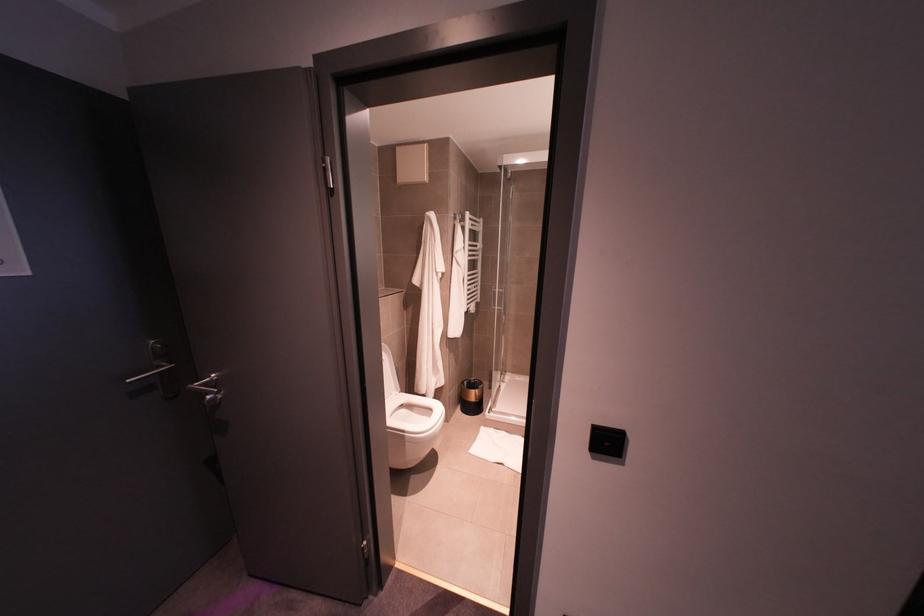
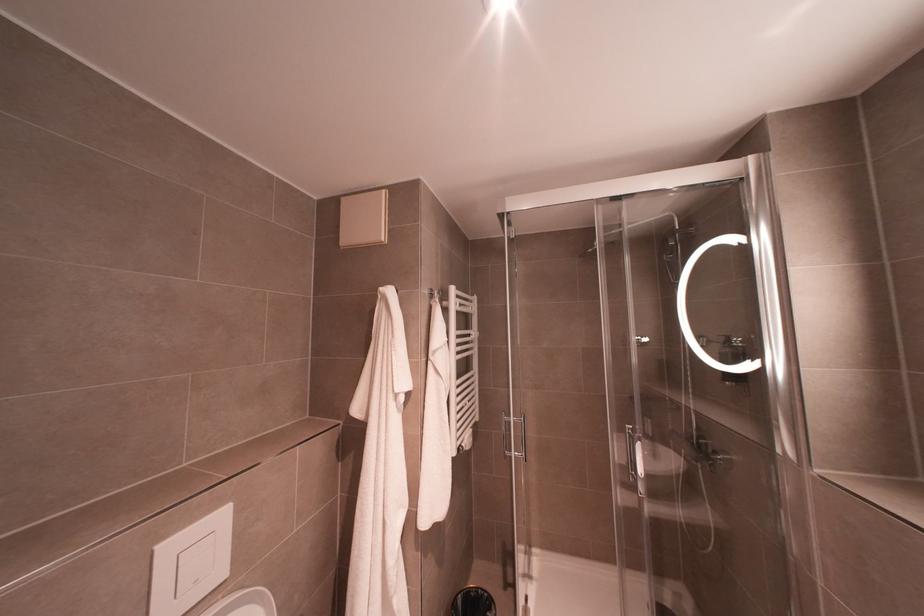
Question: The first image is from the beginning of the video and the second image is from the end. How did the camera likely rotate when shooting the video?

Choices:
 (A) Left
 (B) Right
 (C) Up
 (D) Down

Answer: (C)